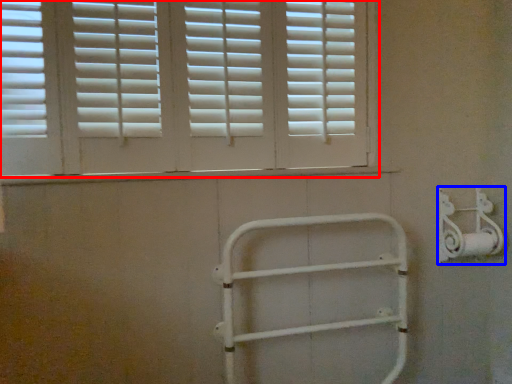
Question: Among these objects, which one is farthest to the camera, window (highlighted by a red box) or metal (highlighted by a blue box)?

Choices:
 (A) window
 (B) metal

Answer: (B)